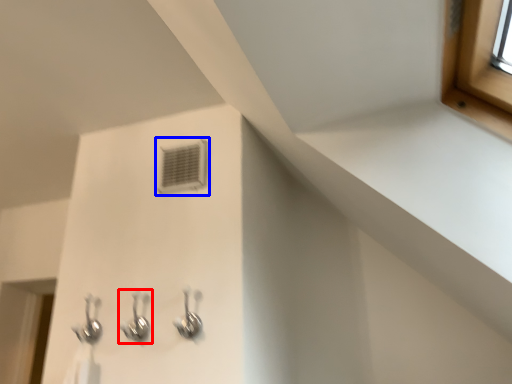
Question: Which point is closer to the camera, plumbing fixture (highlighted by a red box) or air conditioning (highlighted by a blue box)?

Choices:
 (A) plumbing fixture
 (B) air conditioning

Answer: (A)